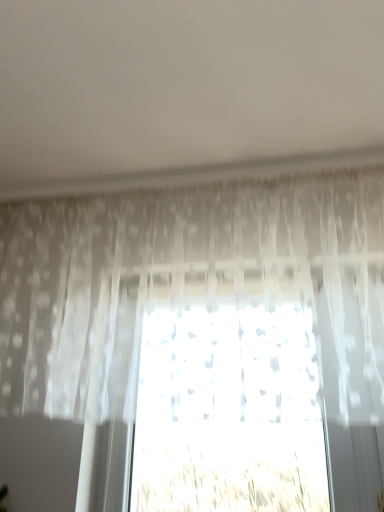
Question: Does translucent fabric plant at center have a lesser width compared to translucent white curtain at center?

Choices:
 (A) no
 (B) yes

Answer: (B)

Question: From the image's perspective, is translucent fabric plant at center over translucent white curtain at center?

Choices:
 (A) yes
 (B) no

Answer: (B)

Question: Does translucent fabric plant at center have a larger size compared to translucent white curtain at center?

Choices:
 (A) no
 (B) yes

Answer: (A)

Question: Is translucent fabric plant at center positioned in front of translucent white curtain at center?

Choices:
 (A) no
 (B) yes

Answer: (A)

Question: From the image's perspective, does translucent fabric plant at center appear lower than translucent white curtain at center?

Choices:
 (A) no
 (B) yes

Answer: (B)

Question: Could you tell me if translucent fabric plant at center is facing translucent white curtain at center?

Choices:
 (A) no
 (B) yes

Answer: (A)

Question: From the image's perspective, is translucent white curtain at center beneath translucent fabric plant at center?

Choices:
 (A) yes
 (B) no

Answer: (B)

Question: Would you say translucent white curtain at center is outside translucent fabric plant at center?

Choices:
 (A) yes
 (B) no

Answer: (A)

Question: Is translucent white curtain at center in front of translucent fabric plant at center?

Choices:
 (A) no
 (B) yes

Answer: (B)

Question: Is translucent white curtain at center taller than translucent fabric plant at center?

Choices:
 (A) yes
 (B) no

Answer: (A)

Question: Is translucent white curtain at center oriented towards translucent fabric plant at center?

Choices:
 (A) yes
 (B) no

Answer: (B)

Question: Is translucent white curtain at center not close to translucent fabric plant at center?

Choices:
 (A) no
 (B) yes

Answer: (A)

Question: Is translucent fabric plant at center to the left or to the right of translucent white curtain at center in the image?

Choices:
 (A) left
 (B) right

Answer: (B)